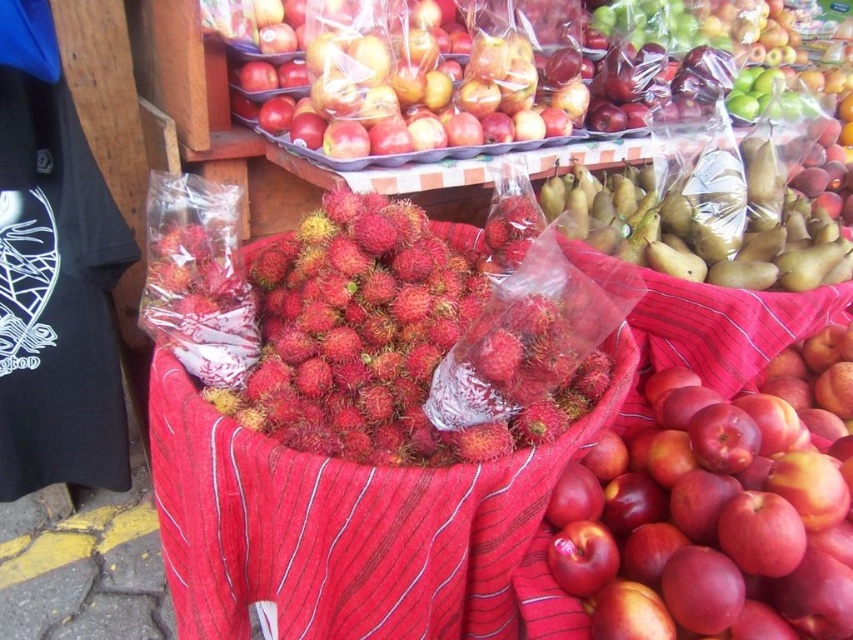
Question: Which object is positioned closest to the green matte pears at center?

Choices:
 (A) glossy red apple at center
 (B) ruddy hairy rambutan at center

Answer: (A)

Question: Does glossy red apple at center lie behind ruddy hairy rambutan at center?

Choices:
 (A) yes
 (B) no

Answer: (B)

Question: Can you confirm if glossy red apple at center is bigger than green matte pears at center?

Choices:
 (A) no
 (B) yes

Answer: (B)

Question: Which point is closer to the camera taking this photo?

Choices:
 (A) (833, 284)
 (B) (350, 428)

Answer: (B)

Question: Which object appears farthest from the camera in this image?

Choices:
 (A) green matte pears at center
 (B) glossy red apple at center
 (C) ruddy hairy rambutan at center

Answer: (A)

Question: Can you confirm if ruddy hairy rambutan at center is positioned to the right of green matte pears at center?

Choices:
 (A) no
 (B) yes

Answer: (A)